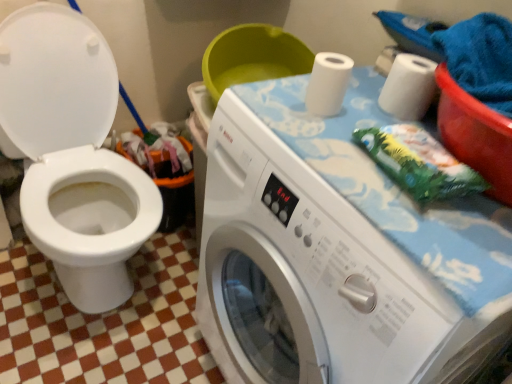
Locate an element on the screen. The image size is (512, 384). free space to the left of white matte toilet paper at upper right, the 2th toilet paper in the right-to-left sequence is located at coordinates (268, 98).